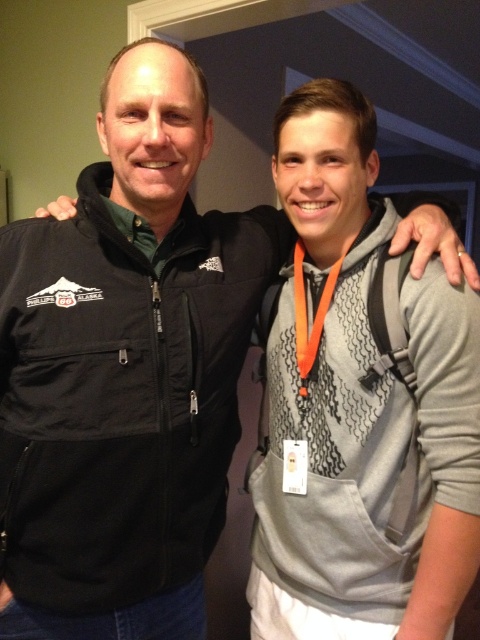
Question: Which object is closer to the camera taking this photo?

Choices:
 (A) orange lanyard at center
 (B) green fabric at center
 (C) orange fabric lanyard at center
 (D) black softshell jacket at center

Answer: (D)

Question: Which of the following is the farthest from the observer?

Choices:
 (A) green fabric at center
 (B) orange lanyard at center
 (C) black softshell jacket at center
 (D) orange fabric lanyard at center

Answer: (D)

Question: Does black softshell jacket at center come in front of green fabric at center?

Choices:
 (A) no
 (B) yes

Answer: (B)

Question: Is black softshell jacket at center positioned at the back of orange lanyard at center?

Choices:
 (A) yes
 (B) no

Answer: (B)

Question: Considering the relative positions of green fabric at center and orange lanyard at center in the image provided, where is green fabric at center located with respect to orange lanyard at center?

Choices:
 (A) right
 (B) left

Answer: (B)

Question: Among these points, which one is nearest to the camera?

Choices:
 (A) (34, 433)
 (B) (123, 230)
 (C) (303, 256)

Answer: (A)